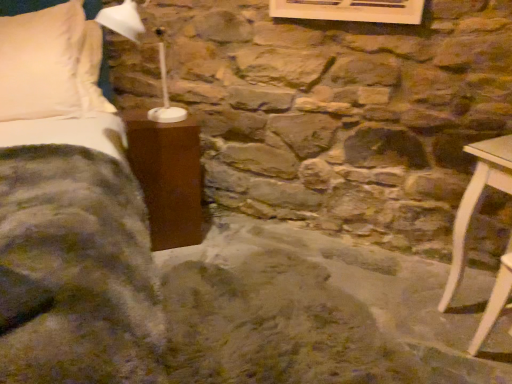
Where is `vacant space to the left of white wood chair at lower right, the second furniture viewed from the left`? The image size is (512, 384). vacant space to the left of white wood chair at lower right, the second furniture viewed from the left is located at coordinates (446, 352).